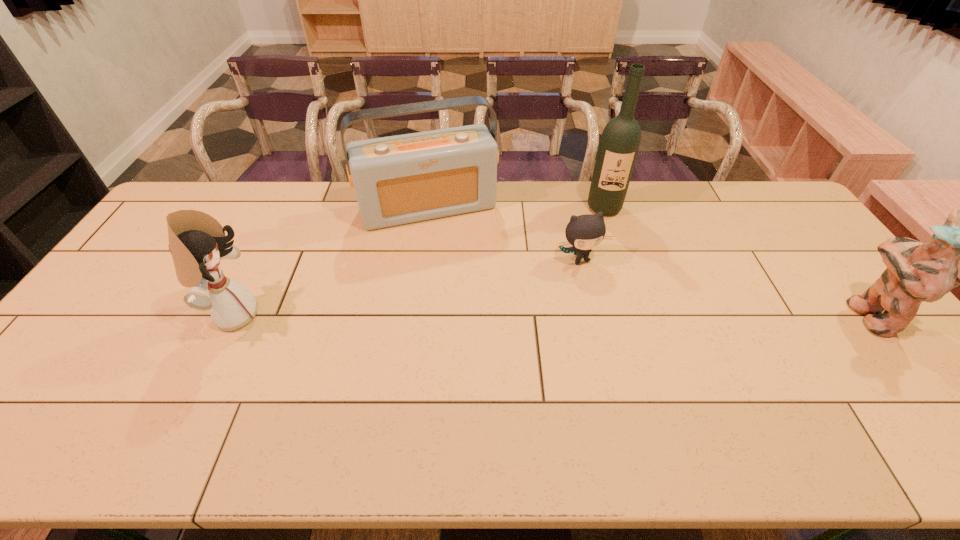
You are a GUI agent. You are given a task and a screenshot of the screen. Output one action in this format:
    pyautogui.click(x=<x>, y=<y>)
    Task: Click on the vacant space on the desktop that is between the leftmost object and the rightmost object and is positioned on the front-facing side of the radio receiver
    
    Given the screenshot: What is the action you would take?
    pyautogui.click(x=466, y=315)

You are a GUI agent. You are given a task and a screenshot of the screen. Output one action in this format:
    pyautogui.click(x=<x>, y=<y>)
    Task: Click on the vacant space on the desktop that is between the doll and the figurine and is positioned on the labeled side of the wine bottle
    The image size is (960, 540).
    Given the screenshot: What is the action you would take?
    pyautogui.click(x=615, y=315)

The height and width of the screenshot is (540, 960). What are the coordinates of `free spot on the desktop that is between the doll and the rightmost object and is positioned on the front-facing side of the third nearest object` in the screenshot? It's located at (609, 315).